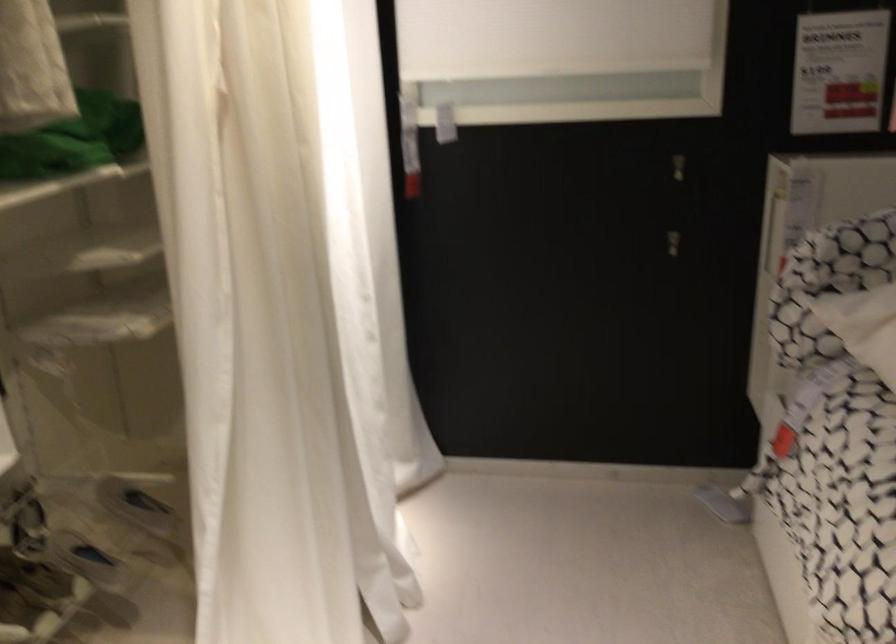
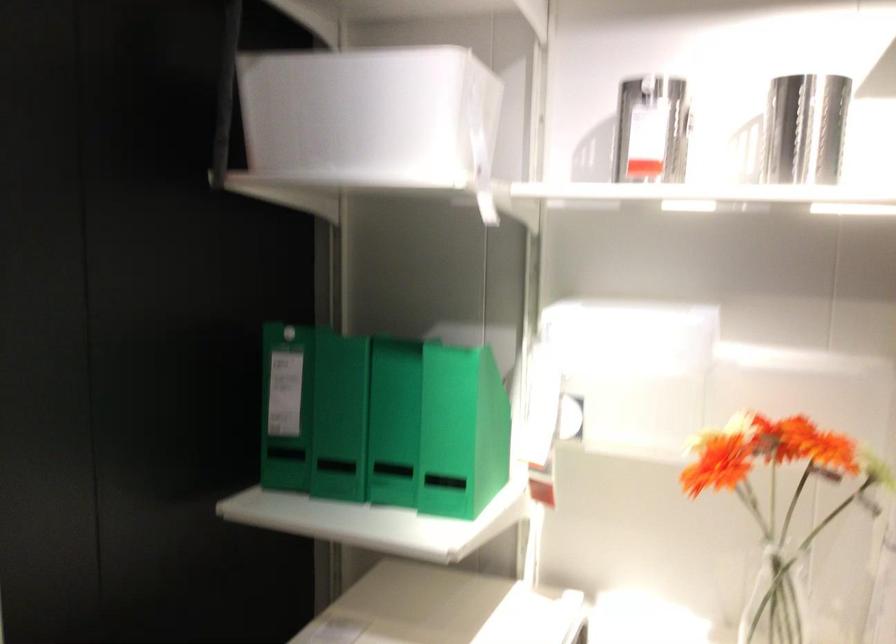
Question: The images are taken continuously from a first-person perspective. In which direction is your viewpoint rotating?

Choices:
 (A) Left
 (B) Right
 (C) Up
 (D) Down

Answer: (A)